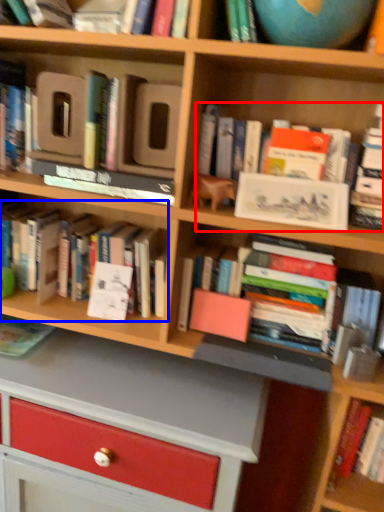
Question: Among these objects, which one is farthest to the camera, book (highlighted by a red box) or book (highlighted by a blue box)?

Choices:
 (A) book
 (B) book

Answer: (B)